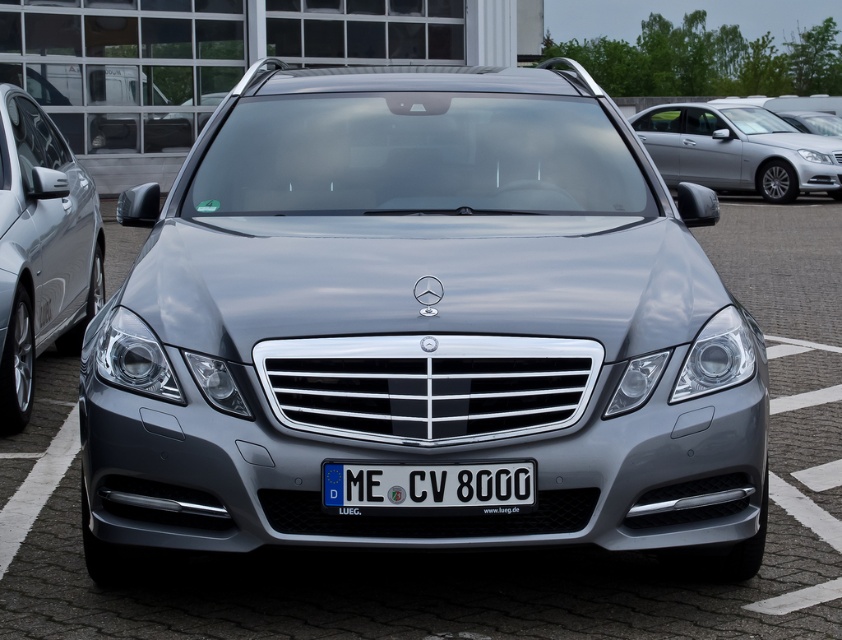
What is located at the point with coordinates (421, 326) in the image?

The point at coordinates (421, 326) is occupied by the satin metallic car at center.

What is the exact location of the satin silver car at upper right in the image?

The satin silver car at upper right is located at point (738,148).

You are a parking attendant and need to guide a driver to park their car. The driver wants to park their satin metallic car at center so that it is directly in front of the satin silver car at upper right. Is this possible given the current layout?

The satin metallic car at center is positioned under the satin silver car at upper right. Therefore, it is already directly in front of the satin silver car at upper right based on the parking lot layout.